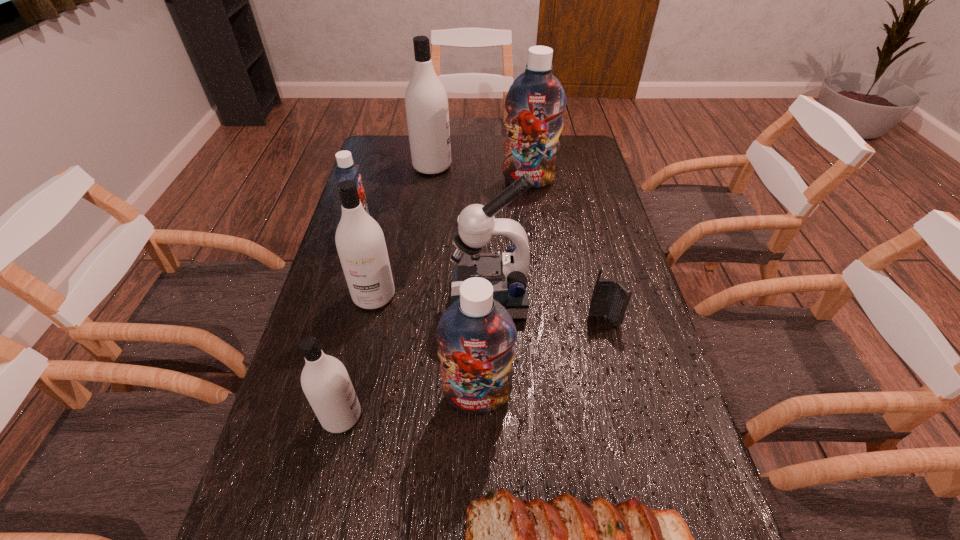
The height and width of the screenshot is (540, 960). Identify the location of the biggest white shampoo. (x=426, y=101).

Where is `the rightmost shampoo`? The height and width of the screenshot is (540, 960). the rightmost shampoo is located at coordinates (535, 102).

Identify the location of the biggest blue shampoo. (535, 102).

Identify the location of gray microscope. (508, 273).

You are a GUI agent. You are given a task and a screenshot of the screen. Output one action in this format:
    pyautogui.click(x=<x>, y=<y>)
    Task: Click on the second smallest white shampoo
    
    Given the screenshot: What is the action you would take?
    pyautogui.click(x=360, y=242)

The width and height of the screenshot is (960, 540). I want to click on the fourth farthest shampoo, so click(x=360, y=242).

Locate an element on the screen. the second shampoo from right to left is located at coordinates (476, 335).

Find the location of a particular element. The height and width of the screenshot is (540, 960). the second blue shampoo from right to left is located at coordinates (476, 335).

Locate an element on the screen. The height and width of the screenshot is (540, 960). the smallest blue shampoo is located at coordinates (346, 169).

You are a GUI agent. You are given a task and a screenshot of the screen. Output one action in this format:
    pyautogui.click(x=<x>, y=<y>)
    Task: Click on the leftmost blue shampoo
    
    Given the screenshot: What is the action you would take?
    pyautogui.click(x=346, y=169)